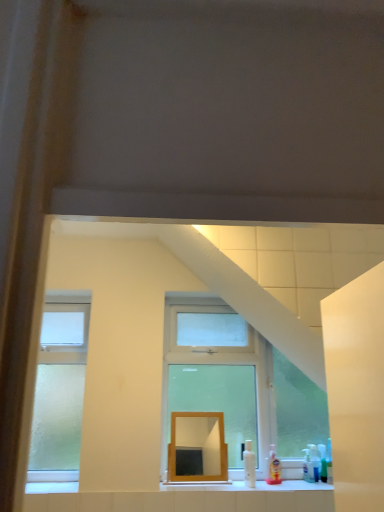
Question: From a real-world perspective, is clear glass window at center below translucent plastic spray bottle at lower right, the 1th toiletry in the right-to-left sequence?

Choices:
 (A) yes
 (B) no

Answer: (B)

Question: Considering the relative sizes of clear glass window at center and translucent plastic spray bottle at lower right, the 1th toiletry in the right-to-left sequence, in the image provided, is clear glass window at center shorter than translucent plastic spray bottle at lower right, the 1th toiletry in the right-to-left sequence,?

Choices:
 (A) no
 (B) yes

Answer: (A)

Question: Is clear glass window at center positioned far away from translucent plastic spray bottle at lower right, arranged as the second toiletry when viewed from the left?

Choices:
 (A) no
 (B) yes

Answer: (A)

Question: Is clear glass window at center further to the viewer compared to translucent plastic spray bottle at lower right, arranged as the second toiletry when viewed from the left?

Choices:
 (A) no
 (B) yes

Answer: (A)

Question: Is clear glass window at center aimed at translucent plastic spray bottle at lower right, the 1th toiletry in the right-to-left sequence?

Choices:
 (A) no
 (B) yes

Answer: (B)

Question: Looking at their shapes, would you say wooden mirror at center is wider or thinner than translucent plastic soap dispenser at lower right, marked as the 1th toiletry in a left-to-right arrangement?

Choices:
 (A) thin
 (B) wide

Answer: (B)

Question: In the image, is wooden mirror at center on the left side or the right side of translucent plastic soap dispenser at lower right, marked as the 1th toiletry in a left-to-right arrangement?

Choices:
 (A) left
 (B) right

Answer: (A)

Question: Relative to translucent plastic soap dispenser at lower right, positioned as the second toiletry in right-to-left order, is wooden mirror at center in front or behind?

Choices:
 (A) behind
 (B) front

Answer: (B)

Question: Is wooden mirror at center bigger or smaller than translucent plastic soap dispenser at lower right, marked as the 1th toiletry in a left-to-right arrangement?

Choices:
 (A) small
 (B) big

Answer: (B)

Question: Would you say translucent plastic spray bottle at lower right, the 1th toiletry in the right-to-left sequence, is inside or outside translucent plastic soap dispenser at lower right, positioned as the second toiletry in right-to-left order?

Choices:
 (A) inside
 (B) outside

Answer: (B)

Question: Considering the positions of point (319, 466) and point (269, 459), is point (319, 466) closer or farther from the camera than point (269, 459)?

Choices:
 (A) farther
 (B) closer

Answer: (B)

Question: From a real-world perspective, is translucent plastic spray bottle at lower right, arranged as the second toiletry when viewed from the left, positioned above or below translucent plastic soap dispenser at lower right, marked as the 1th toiletry in a left-to-right arrangement?

Choices:
 (A) above
 (B) below

Answer: (B)

Question: Considering the relative positions of translucent plastic spray bottle at lower right, arranged as the second toiletry when viewed from the left, and translucent plastic soap dispenser at lower right, positioned as the second toiletry in right-to-left order, in the image provided, is translucent plastic spray bottle at lower right, arranged as the second toiletry when viewed from the left, to the left or to the right of translucent plastic soap dispenser at lower right, positioned as the second toiletry in right-to-left order,?

Choices:
 (A) left
 (B) right

Answer: (B)

Question: From the image's perspective, relative to wooden mirror at center, is clear glass window at center above or below?

Choices:
 (A) above
 (B) below

Answer: (A)

Question: Would you say clear glass window at center is to the left or to the right of wooden mirror at center in the picture?

Choices:
 (A) right
 (B) left

Answer: (A)